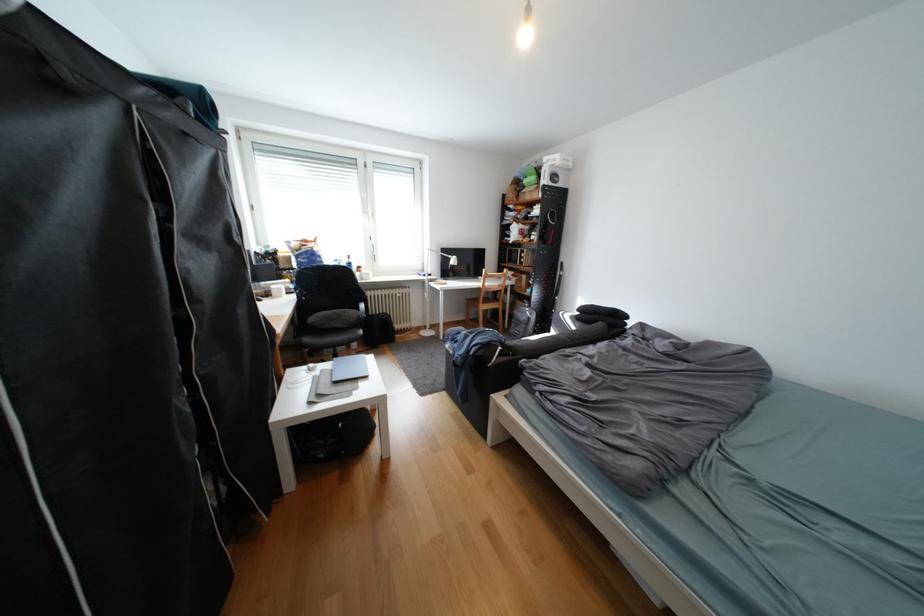
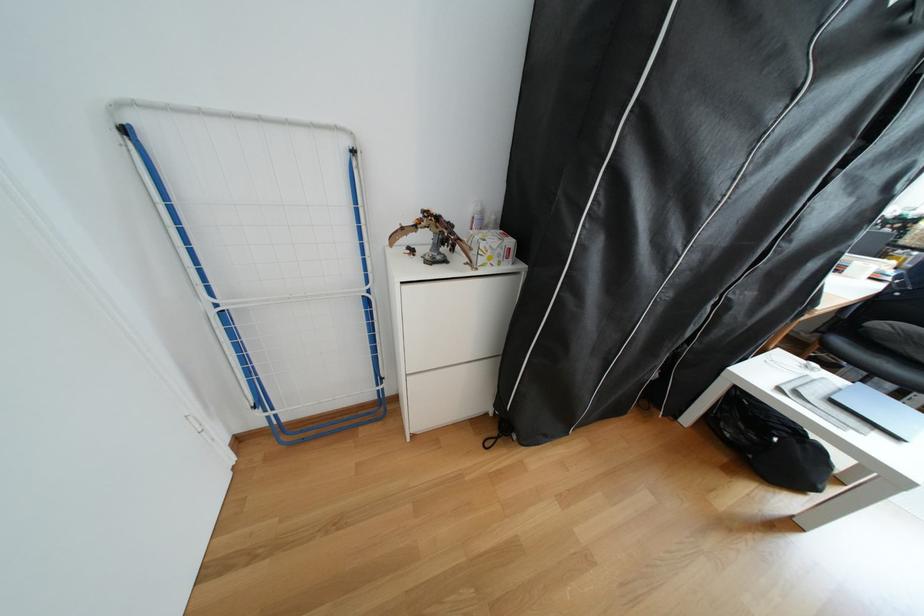
In the second image, find the point that corresponds to point (380, 378) in the first image.

(908, 439)